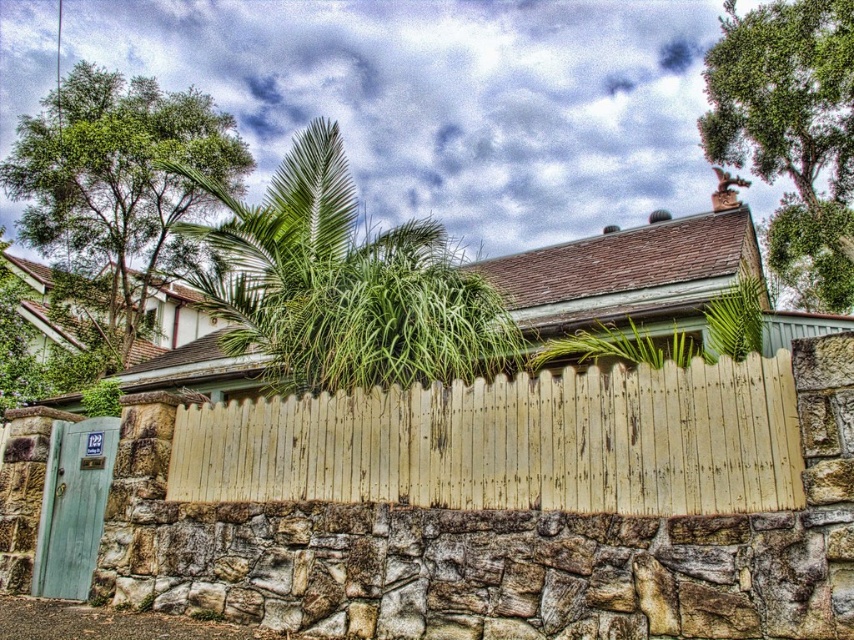
Who is lower down, green leafy tree at upper left or green leafy tree at upper right?

green leafy tree at upper right is lower down.

Can you confirm if green leafy tree at upper left is taller than green leafy tree at upper right?

No.

Who is more forward, (32, 131) or (846, 26)?

Positioned in front is point (846, 26).

At what (x,y) coordinates should I click in order to perform the action: click on green leafy tree at upper left. Please return your answer as a coordinate pair (x, y). The image size is (854, 640). Looking at the image, I should click on (115, 186).

Between yellow weathered wood fence at center and green leafy tree at upper right, which one appears on the right side from the viewer's perspective?

Positioned to the right is green leafy tree at upper right.

Measure the distance between point (723, 452) and camera.

Point (723, 452) and camera are 4.57 meters apart from each other.

At what (x,y) coordinates should I click in order to perform the action: click on yellow weathered wood fence at center. Please return your answer as a coordinate pair (x, y). This screenshot has width=854, height=640. Looking at the image, I should click on (513, 444).

Is green leafy palm at upper center wider than green leafy tree at upper left?

Incorrect, green leafy palm at upper center's width does not surpass green leafy tree at upper left's.

Does point (258, 268) lie in front of point (75, 221)?

Yes, it is in front of point (75, 221).

The width and height of the screenshot is (854, 640). I want to click on green leafy palm at upper center, so click(x=343, y=284).